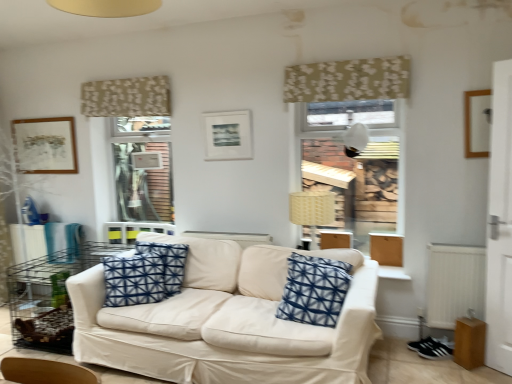
Question: Is the depth of white fabric couch at center greater than that of beige floral fabric at upper center, acting as the first curtain starting from the left?

Choices:
 (A) yes
 (B) no

Answer: (B)

Question: From the image's perspective, would you say white fabric couch at center is positioned over beige floral fabric at upper center, acting as the first curtain starting from the left?

Choices:
 (A) yes
 (B) no

Answer: (B)

Question: From the image's perspective, is white fabric couch at center beneath beige floral fabric at upper center, acting as the second curtain starting from the front?

Choices:
 (A) yes
 (B) no

Answer: (A)

Question: Are white fabric couch at center and beige floral fabric at upper center, acting as the first curtain starting from the left, making contact?

Choices:
 (A) no
 (B) yes

Answer: (A)

Question: Is white fabric couch at center positioned beyond the bounds of beige floral fabric at upper center, marked as the 2th curtain in a right-to-left arrangement?

Choices:
 (A) no
 (B) yes

Answer: (B)

Question: In the image, is metal wire table at left on the left side or the right side of beige woven lampshade at center?

Choices:
 (A) left
 (B) right

Answer: (A)

Question: In terms of height, does metal wire table at left look taller or shorter compared to beige woven lampshade at center?

Choices:
 (A) tall
 (B) short

Answer: (A)

Question: Is point (53, 256) closer or farther from the camera than point (314, 226)?

Choices:
 (A) farther
 (B) closer

Answer: (A)

Question: From a real-world perspective, relative to beige woven lampshade at center, is metal wire table at left vertically above or below?

Choices:
 (A) above
 (B) below

Answer: (B)

Question: From the image's perspective, relative to blue printed cushion at center, the 1th pillow viewed from the right, is matte brown picture frame at upper left, which is counted as the 3th picture frame, starting from the right, above or below?

Choices:
 (A) above
 (B) below

Answer: (A)

Question: Is matte brown picture frame at upper left, placed as the 1th picture frame when sorted from left to right, to the left or to the right of blue printed cushion at center, the 1th pillow viewed from the right, in the image?

Choices:
 (A) right
 (B) left

Answer: (B)

Question: In terms of size, does matte brown picture frame at upper left, the first picture frame from the back, appear bigger or smaller than blue printed cushion at center, the 1th pillow viewed from the right?

Choices:
 (A) small
 (B) big

Answer: (A)

Question: Considering the positions of matte brown picture frame at upper left, which is counted as the 3th picture frame, starting from the right, and blue printed cushion at center, the 1th pillow viewed from the right, in the image, is matte brown picture frame at upper left, which is counted as the 3th picture frame, starting from the right, wider or thinner than blue printed cushion at center, the 1th pillow viewed from the right,?

Choices:
 (A) thin
 (B) wide

Answer: (A)

Question: From a real-world perspective, relative to matte brown picture frame at upper left, which appears as the third picture frame when viewed from the front, is beige floral fabric at upper center, acting as the second curtain starting from the front, vertically above or below?

Choices:
 (A) below
 (B) above

Answer: (B)

Question: In the image, is beige floral fabric at upper center, acting as the second curtain starting from the front, positioned in front of or behind matte brown picture frame at upper left, placed as the 1th picture frame when sorted from left to right?

Choices:
 (A) front
 (B) behind

Answer: (A)